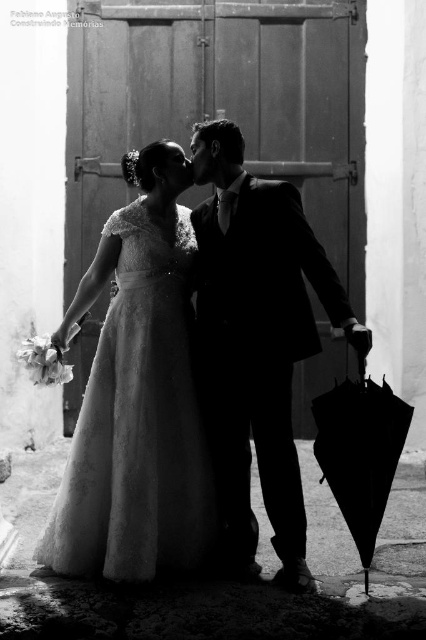
Between satin white gown at center and black matte umbrella at lower right, which one has less height?

black matte umbrella at lower right is shorter.

Where is `satin white gown at center`? The height and width of the screenshot is (640, 426). satin white gown at center is located at coordinates (138, 396).

Which is in front, point (135, 294) or point (374, 532)?

Positioned in front is point (374, 532).

The height and width of the screenshot is (640, 426). I want to click on satin white gown at center, so click(x=138, y=396).

Who is shorter, satin black suit at center or black matte umbrella at lower right?

Standing shorter between the two is black matte umbrella at lower right.

Is satin black suit at center thinner than black matte umbrella at lower right?

No, satin black suit at center is not thinner than black matte umbrella at lower right.

Identify the location of satin black suit at center. (258, 339).

The image size is (426, 640). Identify the location of satin black suit at center. (258, 339).

Looking at this image, is satin white gown at center further to the viewer compared to satin black suit at center?

Yes, it is behind satin black suit at center.

This screenshot has height=640, width=426. Describe the element at coordinates (138, 396) in the screenshot. I see `satin white gown at center` at that location.

Identify the location of satin white gown at center. (138, 396).